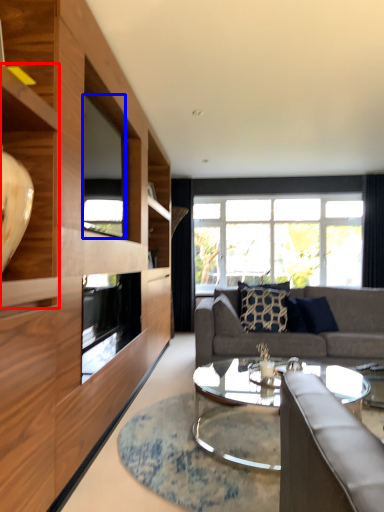
Question: Which object is closer to the camera taking this photo, shelf (highlighted by a red box) or window screen (highlighted by a blue box)?

Choices:
 (A) shelf
 (B) window screen

Answer: (A)